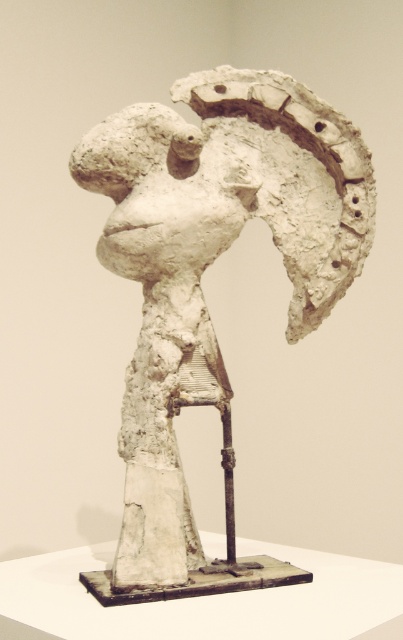
Can you confirm if white clay sculpture at center is wider than white clay head at center?

Indeed, white clay sculpture at center has a greater width compared to white clay head at center.

Is white clay sculpture at center above white clay head at center?

Incorrect, white clay sculpture at center is not positioned above white clay head at center.

Measure the distance between white clay sculpture at center and camera.

white clay sculpture at center is 4.70 feet away from camera.

Locate an element on the screen. white clay sculpture at center is located at coordinates (201, 289).